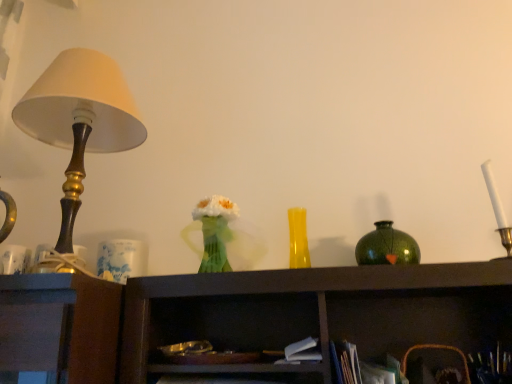
Question: Considering the relative sizes of yellow glass vase at center, which is the 2th vase from right to left, and translucent green vase at center in the image provided, is yellow glass vase at center, which is the 2th vase from right to left, bigger than translucent green vase at center?

Choices:
 (A) no
 (B) yes

Answer: (A)

Question: Is yellow glass vase at center, which is the 2th vase from right to left, not within translucent green vase at center?

Choices:
 (A) yes
 (B) no

Answer: (A)

Question: Could translucent green vase at center be considered to be inside yellow glass vase at center, which is counted as the first vase, starting from the left?

Choices:
 (A) no
 (B) yes

Answer: (A)

Question: Is yellow glass vase at center, which is counted as the first vase, starting from the left, closer to camera compared to translucent green vase at center?

Choices:
 (A) no
 (B) yes

Answer: (A)

Question: Does yellow glass vase at center, which is counted as the first vase, starting from the left, have a greater width compared to translucent green vase at center?

Choices:
 (A) yes
 (B) no

Answer: (B)

Question: Considering the positions of green speckled vase at upper right, the second vase when ordered from left to right, and yellow glass vase at center, which is the 2th vase from right to left, in the image, is green speckled vase at upper right, the second vase when ordered from left to right, wider or thinner than yellow glass vase at center, which is the 2th vase from right to left,?

Choices:
 (A) thin
 (B) wide

Answer: (A)

Question: From the image's perspective, is green speckled vase at upper right, the 1th vase positioned from the right, above or below yellow glass vase at center, which is the 2th vase from right to left?

Choices:
 (A) above
 (B) below

Answer: (B)

Question: Is green speckled vase at upper right, the 1th vase positioned from the right, in front of or behind yellow glass vase at center, which is the 2th vase from right to left, in the image?

Choices:
 (A) behind
 (B) front

Answer: (B)

Question: In terms of size, does green speckled vase at upper right, the second vase when ordered from left to right, appear bigger or smaller than yellow glass vase at center, which is the 2th vase from right to left?

Choices:
 (A) big
 (B) small

Answer: (A)

Question: From a real-world perspective, is translucent green vase at center positioned above or below yellow glass vase at center, which is counted as the first vase, starting from the left?

Choices:
 (A) above
 (B) below

Answer: (B)

Question: Considering the positions of translucent green vase at center and yellow glass vase at center, which is counted as the first vase, starting from the left, in the image, is translucent green vase at center taller or shorter than yellow glass vase at center, which is counted as the first vase, starting from the left,?

Choices:
 (A) tall
 (B) short

Answer: (A)

Question: In terms of width, does translucent green vase at center look wider or thinner when compared to yellow glass vase at center, which is counted as the first vase, starting from the left?

Choices:
 (A) thin
 (B) wide

Answer: (B)

Question: Is translucent green vase at center spatially inside yellow glass vase at center, which is the 2th vase from right to left, or outside of it?

Choices:
 (A) inside
 (B) outside

Answer: (B)

Question: Do you think matte gold lamp at left is within translucent green vase at center, or outside of it?

Choices:
 (A) outside
 (B) inside

Answer: (A)

Question: From the image's perspective, is matte gold lamp at left above or below translucent green vase at center?

Choices:
 (A) below
 (B) above

Answer: (B)